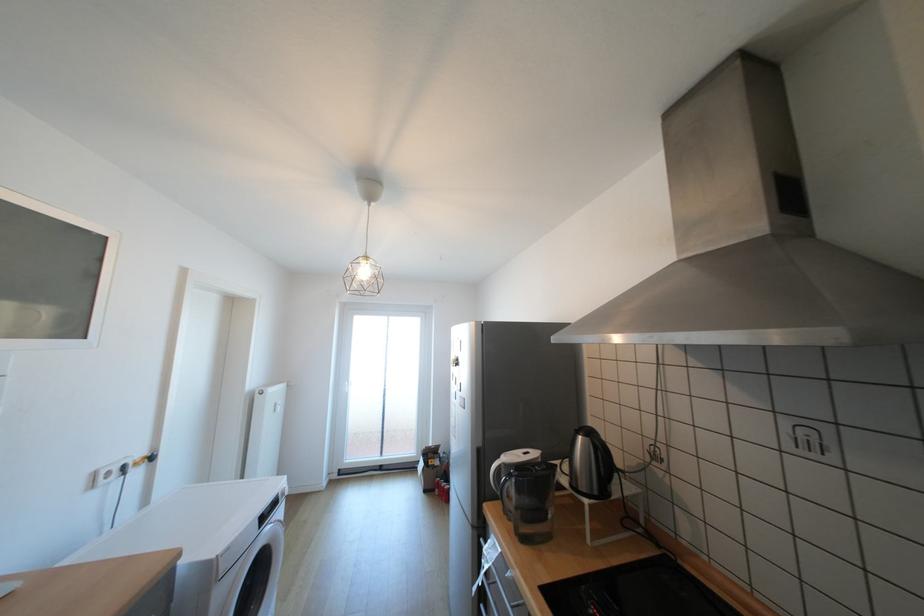
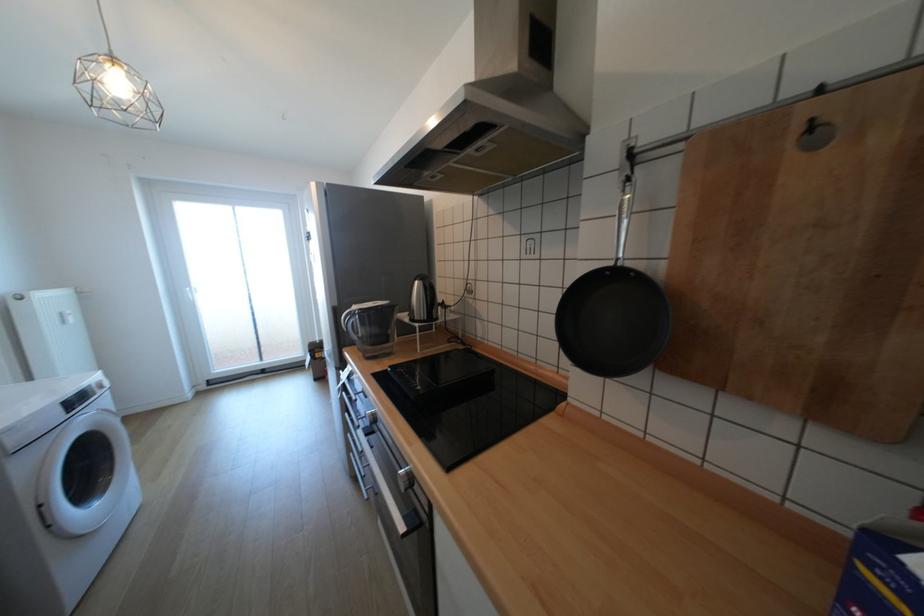
What movement of the cameraman would produce the second image?

The cameraman moved toward right, backward.